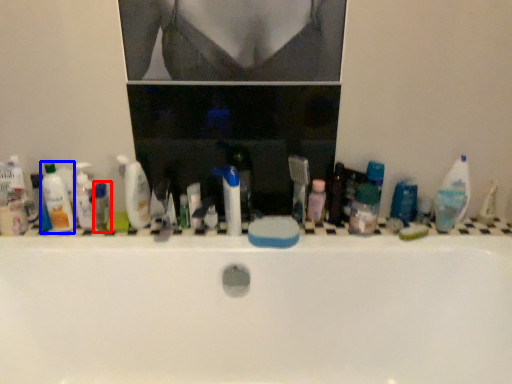
Question: Among these objects, which one is nearest to the camera, toiletry (highlighted by a red box) or mouthwash (highlighted by a blue box)?

Choices:
 (A) toiletry
 (B) mouthwash

Answer: (B)